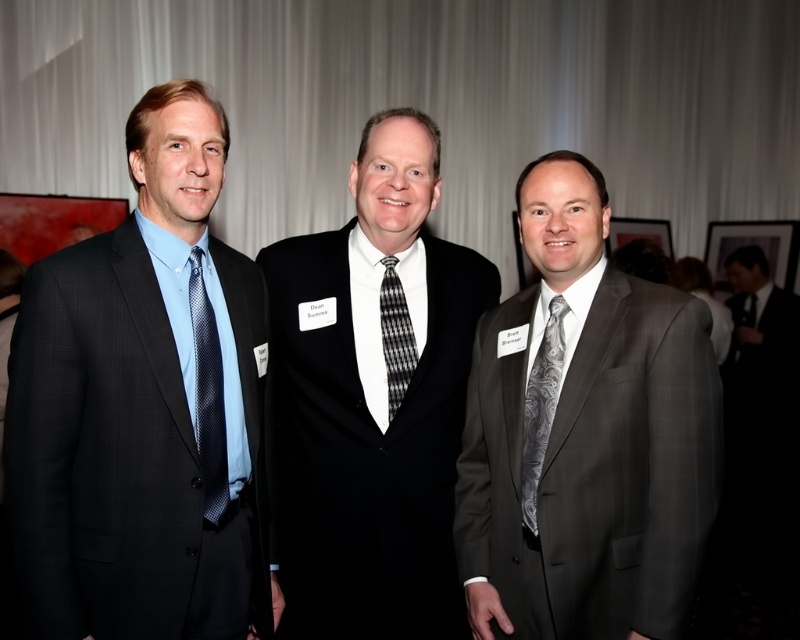
Question: Which object is farther from the camera taking this photo?

Choices:
 (A) blue dotted tie at left
 (B) silver metallic tie at right

Answer: (B)

Question: Which object appears closest to the camera in this image?

Choices:
 (A) silver metallic tie at right
 (B) matte black suit at left

Answer: (B)

Question: Can you confirm if gray textured suit at center is positioned to the left of silver metallic tie at right?

Choices:
 (A) no
 (B) yes

Answer: (A)

Question: Can you confirm if matte black suit at left is positioned to the right of black textured tie at center?

Choices:
 (A) no
 (B) yes

Answer: (A)

Question: Which point is closer to the camera?

Choices:
 (A) (554, 339)
 (B) (392, 285)

Answer: (A)

Question: Does gray textured suit at center appear on the left side of blue dotted tie at left?

Choices:
 (A) yes
 (B) no

Answer: (B)